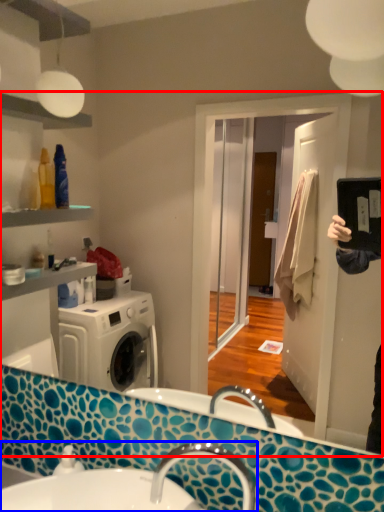
Question: Which object appears farthest to the camera in this image, mirror (highlighted by a red box) or sink (highlighted by a blue box)?

Choices:
 (A) mirror
 (B) sink

Answer: (B)